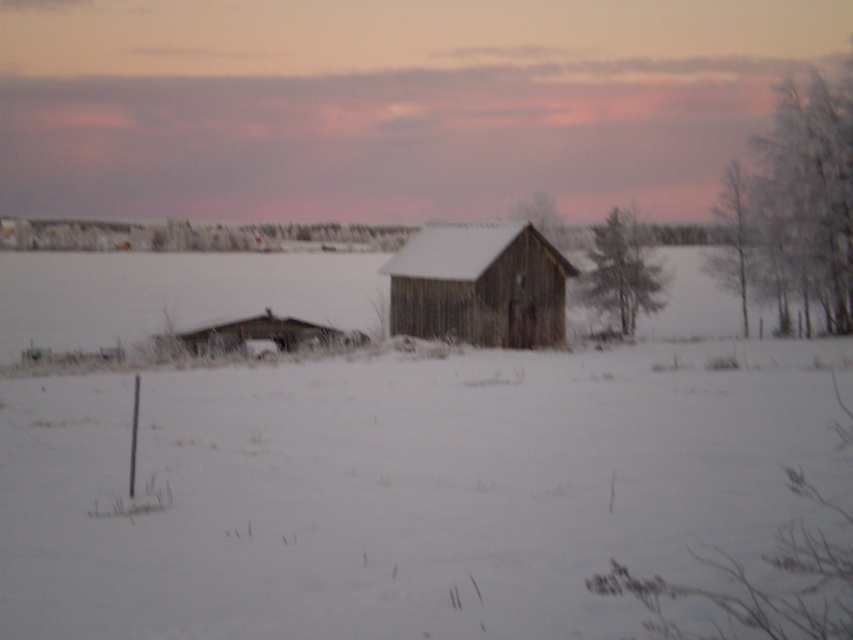
Does weathered wood barn at center have a larger size compared to smooth bark tree at right?

Incorrect, weathered wood barn at center is not larger than smooth bark tree at right.

Which is above, weathered wood barn at center or smooth bark tree at right?

Positioned higher is smooth bark tree at right.

Locate an element on the screen. weathered wood barn at center is located at coordinates (479, 285).

Which is in front, point (490, 296) or point (584, 285)?

Point (490, 296) is more forward.

Find the location of a particular element. weathered wood barn at center is located at coordinates (479, 285).

Is green textured pine at center closer to the viewer compared to smooth wooden house at center?

No.

Is green textured pine at center further to camera compared to smooth wooden house at center?

Yes, it is behind smooth wooden house at center.

Identify the location of green textured pine at center. (622, 273).